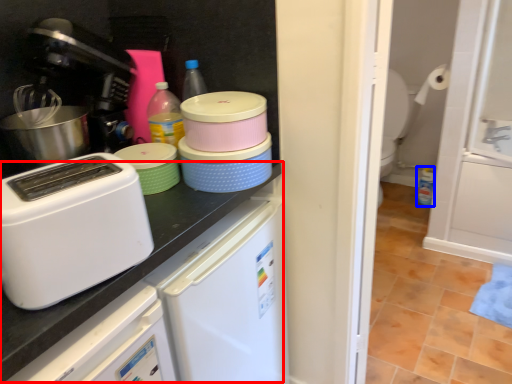
Question: Which point is further to the camera, counter top (highlighted by a red box) or bottle (highlighted by a blue box)?

Choices:
 (A) counter top
 (B) bottle

Answer: (B)